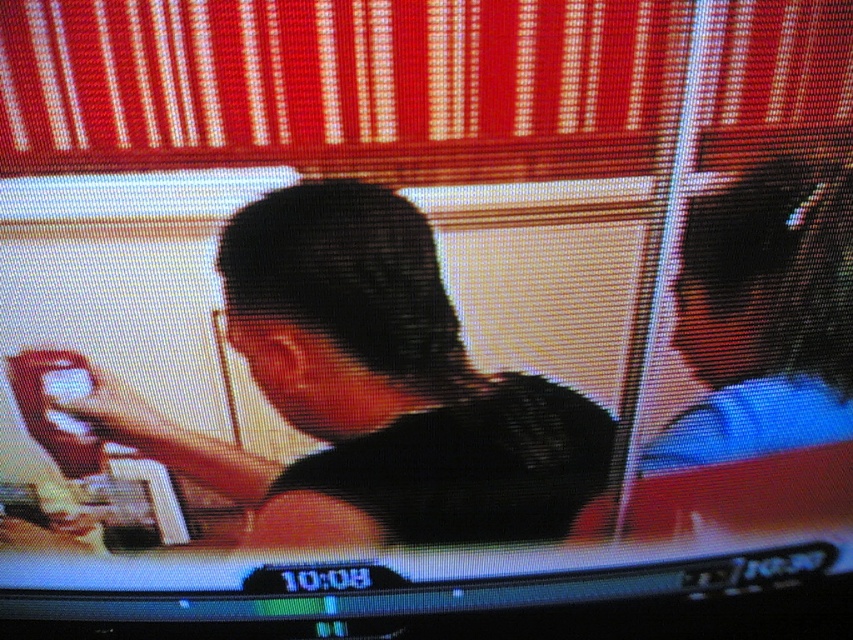
Between black matte shirt at center and matte black hair at upper right, which one is positioned higher?

Positioned higher is matte black hair at upper right.

Between point (84, 406) and point (723, 337), which one is positioned behind?

The point (84, 406) is behind.

What do you see at coordinates (369, 390) in the screenshot? I see `black matte shirt at center` at bounding box center [369, 390].

At what (x,y) coordinates should I click in order to perform the action: click on black matte shirt at center. Please return your answer as a coordinate pair (x, y). Looking at the image, I should click on (369, 390).